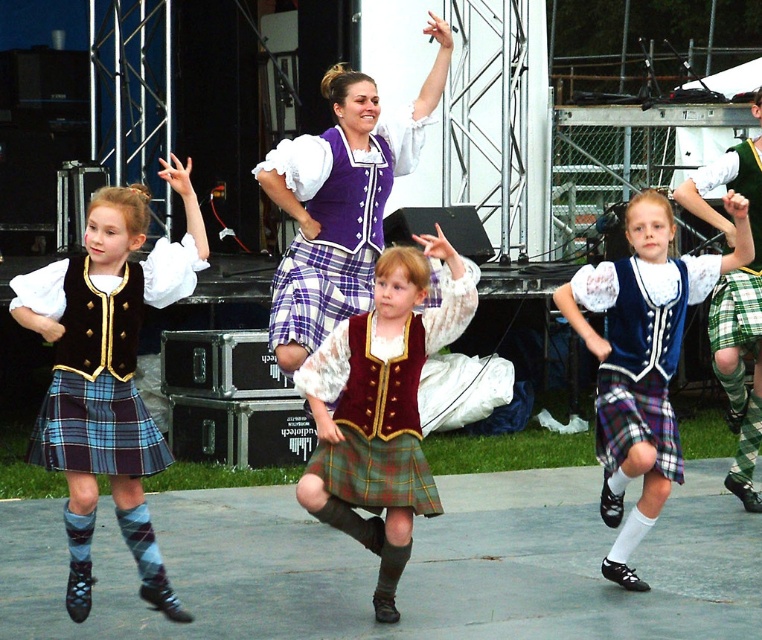
You are a photographer at the back of the stage. You need to capture a photo where both the velvet maroon vest at center and the purple satin dress at center are visible. Based on their positions, which one should you focus on first to ensure both are in frame?

The velvet maroon vest at center is to the right of the purple satin dress at center. To ensure both are in frame, focus on the purple satin dress at center first, then adjust to include the velvet maroon vest at center to the right.

Looking at this image, in the scene of the Scottish dance performance, there are two central items of clothing worn by the lead dancer. These are the plaid wool kilt at center and the blue velvet vest at center. Which of these two items is positioned higher on the dancer?

The plaid wool kilt at center is located above the blue velvet vest at center, so the plaid wool kilt at center is positioned higher on the dancer.